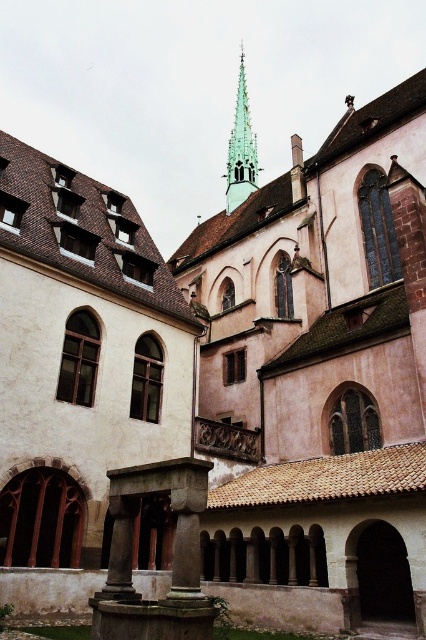
You are an architect analyzing the layout of this historic building. Based on the image, which object takes up more area in the scene between the green stone fountain at lower center and the green glass spire at upper center?

The green glass spire at upper center occupies more space in the scene compared to the green stone fountain at lower center.

You are standing in front of the historic building and notice two points marked on its facade. The first point is located at coordinates point (187, 516) and the second at point (253, 163). Which of these points is positioned closer to your current viewpoint?

Point (187, 516) is closer to the viewer than point (253, 163).

You are standing in front of the historic building and notice a point marked at coordinates (172, 556). Based on the scene description, can you identify which object this point belongs to?

The point at coordinates (172, 556) is located on the green stone fountain at lower center.